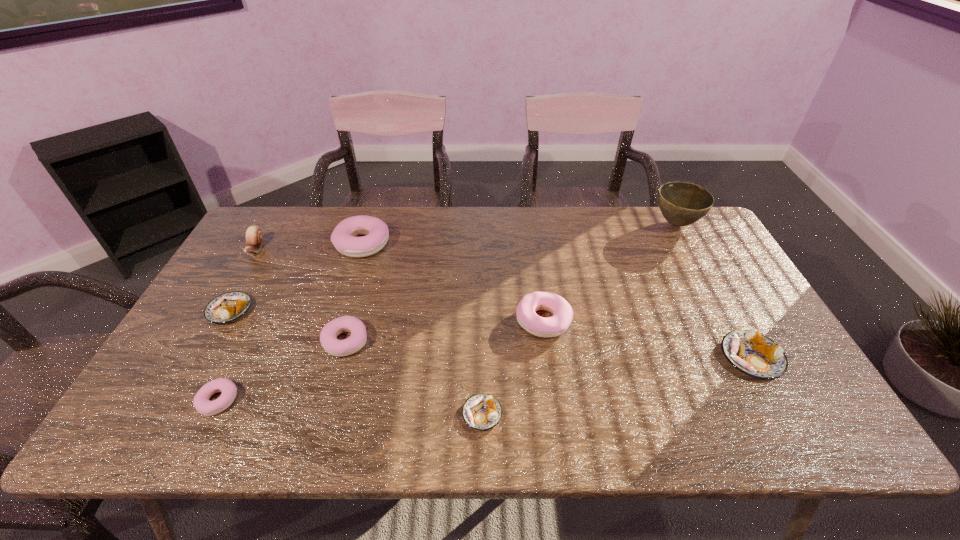
Find the location of a particular element. the second biggest brown pastry is located at coordinates (227, 307).

Find the location of `the farthest brown pastry`. the farthest brown pastry is located at coordinates (227, 307).

Locate an element on the screen. Image resolution: width=960 pixels, height=540 pixels. the smallest pink pastry is located at coordinates (202, 404).

You are a GUI agent. You are given a task and a screenshot of the screen. Output one action in this format:
    pyautogui.click(x=<x>, y=<y>)
    Task: Click on the nearest pink pastry
    
    Given the screenshot: What is the action you would take?
    [x=202, y=404]

This screenshot has width=960, height=540. Identify the location of the third pastry from right to left. point(481,411).

Identify the location of the second brown pastry from left to right. 481,411.

In order to click on free spot located on the front of the bowl in this screenshot , I will do `click(716, 298)`.

In order to click on free space located on the front-facing side of the escargot in this screenshot , I will do `click(240, 275)`.

I want to click on vacant space located 0.120m on the right of the tallest pastry, so click(426, 244).

Locate an element on the screen. The image size is (960, 540). free space located on the back of the sixth pastry from left to right is located at coordinates (531, 231).